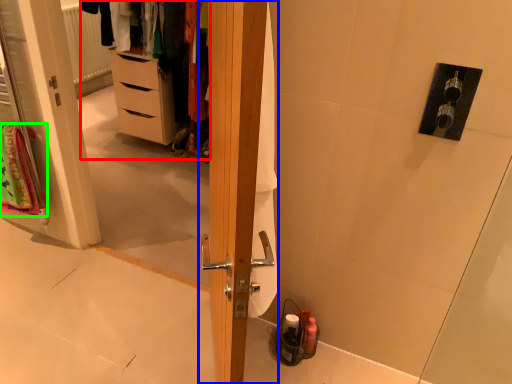
Question: Estimate the real-world distances between objects in this image. Which object is farther from dresser (highlighted by a red box), door (highlighted by a blue box) or bath towel (highlighted by a green box)?

Choices:
 (A) door
 (B) bath towel

Answer: (A)